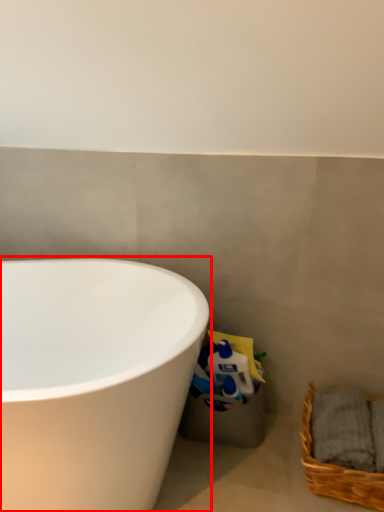
Question: From the image's perspective, what is the correct spatial relationship of bathtub (annotated by the red box) in relation to picnic basket?

Choices:
 (A) above
 (B) below

Answer: (A)